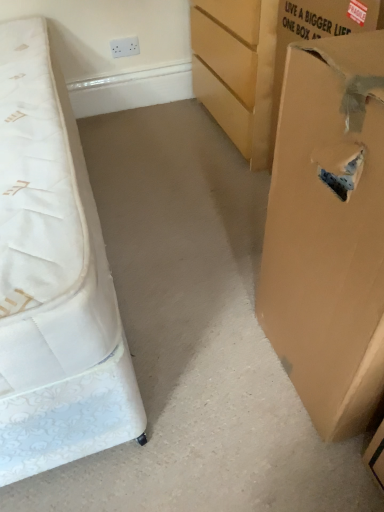
Where is `free space to the left of brown cardboard box at right, the 1th cardboard box from the front`? Image resolution: width=384 pixels, height=512 pixels. free space to the left of brown cardboard box at right, the 1th cardboard box from the front is located at coordinates (216, 371).